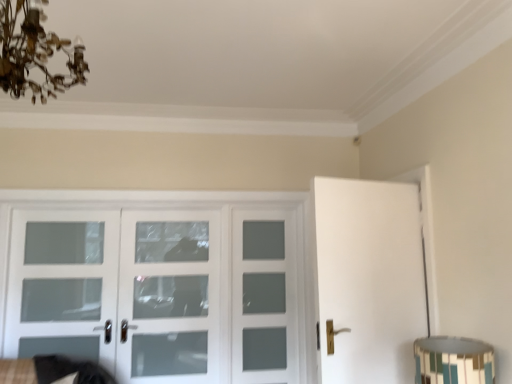
Question: Is clear glass door at left, which is counted as the first screen door, starting from the left, bigger or smaller than white glass door at center?

Choices:
 (A) big
 (B) small

Answer: (B)

Question: From a real-world perspective, is clear glass door at left, which is counted as the first screen door, starting from the left, physically located above or below white glass door at center?

Choices:
 (A) above
 (B) below

Answer: (A)

Question: Based on their relative distances, which object is farther from the clear glass door at left, which is counted as the first screen door, starting from the left?

Choices:
 (A) antique brass chandelier at upper left
 (B) white glass door at center
 (C) white frosted glass door at center, placed as the 3th screen door when sorted from left to right
 (D) multicolored mosaic lampshade at lower right
 (E) white frosted glass door at center, arranged as the 2th screen door when viewed from the left

Answer: (D)

Question: Estimate the real-world distances between objects in this image. Which object is farther from the multicolored mosaic lampshade at lower right?

Choices:
 (A) clear glass door at left, which is the third screen door from right to left
 (B) white glass door at center
 (C) white frosted glass door at center, the 1th screen door in the right-to-left sequence
 (D) white frosted glass door at center, arranged as the 2th screen door when viewed from the left
 (E) antique brass chandelier at upper left

Answer: (A)